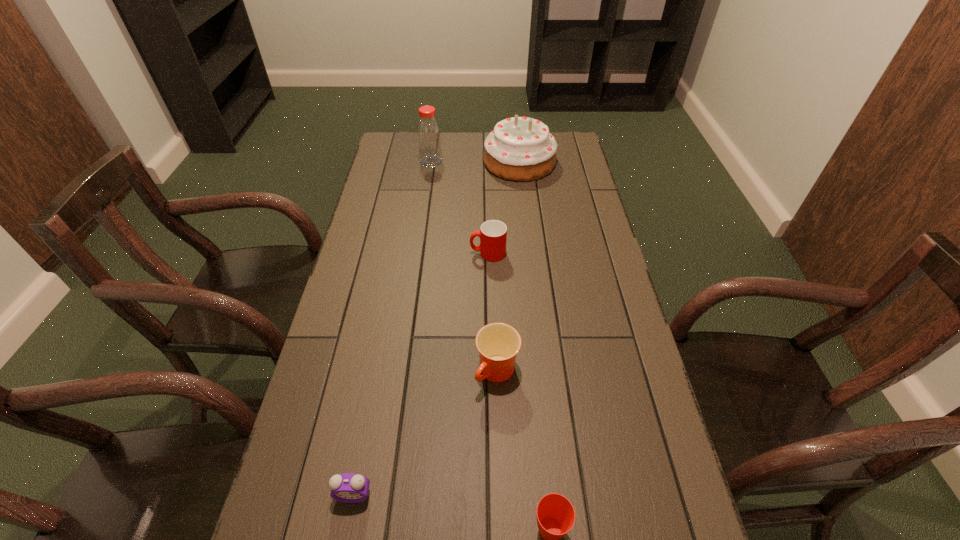
The width and height of the screenshot is (960, 540). I want to click on unoccupied area between the farthest cup and the bottle, so click(x=460, y=207).

Find the location of a particular element. This screenshot has height=540, width=960. free space between the cake and the second farthest cup is located at coordinates [x=508, y=267].

You are a GUI agent. You are given a task and a screenshot of the screen. Output one action in this format:
    pyautogui.click(x=<x>, y=<y>)
    Task: Click on the free point between the alarm clock and the bottle
    This screenshot has width=960, height=540.
    Given the screenshot: What is the action you would take?
    pyautogui.click(x=393, y=328)

I want to click on free space between the cake and the second nearest cup, so click(508, 267).

Where is `unoccupied position between the third farthest object and the fifth farthest object`? unoccupied position between the third farthest object and the fifth farthest object is located at coordinates (420, 374).

Where is `free space between the cake and the second nearest object`? This screenshot has width=960, height=540. free space between the cake and the second nearest object is located at coordinates (437, 329).

I want to click on vacant region between the third nearest object and the shortest object, so click(x=425, y=434).

This screenshot has height=540, width=960. Find the location of `free space that is in between the bottle and the fourth farthest object`. free space that is in between the bottle and the fourth farthest object is located at coordinates (465, 267).

Identify which object is the nearest to the third farthest object. Please provide its 2D coordinates. Your answer should be formatted as a tuple, i.e. [(x, y)], where the tuple contains the x and y coordinates of a point satisfying the conditions above.

[(498, 344)]

Identify which object is the second closest to the bottle. Please provide its 2D coordinates. Your answer should be formatted as a tuple, i.e. [(x, y)], where the tuple contains the x and y coordinates of a point satisfying the conditions above.

[(493, 233)]